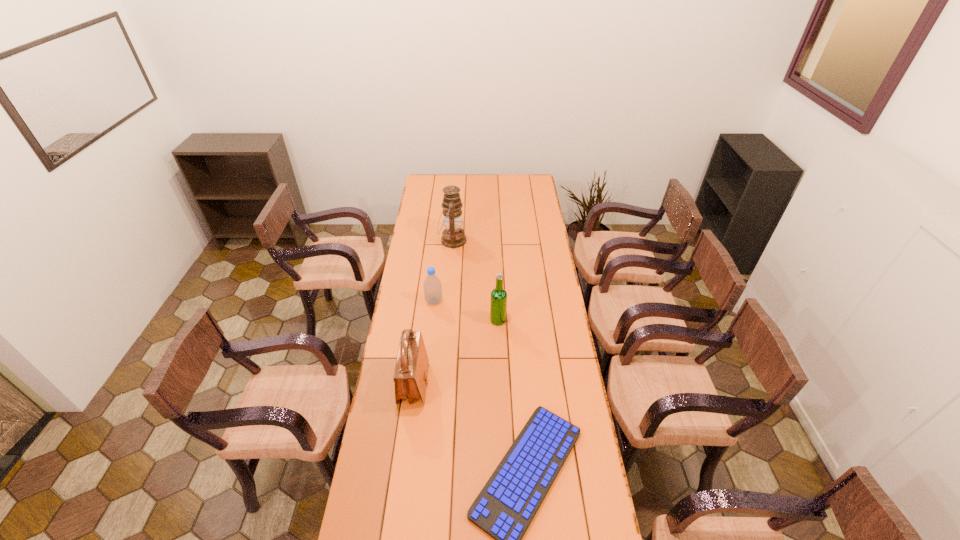
Where is `lantern at the left edge`? lantern at the left edge is located at coordinates (453, 236).

The image size is (960, 540). I want to click on shoulder bag present at the left edge, so click(411, 372).

In order to click on bottle positioned at the left edge in this screenshot , I will do `click(432, 285)`.

I want to click on free region at the left edge of the desktop, so click(x=437, y=237).

Find the location of a particular element. The width and height of the screenshot is (960, 540). vacant space at the right edge of the desktop is located at coordinates (532, 251).

Locate an element on the screen. vacant space at the far left corner of the desktop is located at coordinates (425, 176).

Locate an element on the screen. The image size is (960, 540). free space between the lantern and the shoulder bag is located at coordinates (433, 312).

Identify the location of vacant area that lies between the lantern and the bottle. This screenshot has width=960, height=540. (444, 271).

At what (x,y) coordinates should I click in order to perform the action: click on vacant point located between the second nearest object and the tallest object. Please return your answer as a coordinate pair (x, y). The height and width of the screenshot is (540, 960). Looking at the image, I should click on (433, 312).

Find the location of a particular element. The width and height of the screenshot is (960, 540). free space that is in between the lantern and the third nearest object is located at coordinates (475, 280).